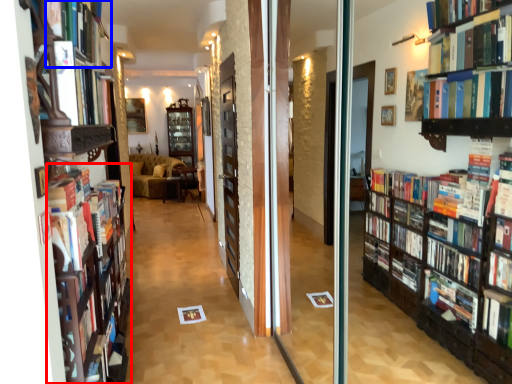
Question: Which of the following is the closest to the observer, bookshelf (highlighted by a red box) or book (highlighted by a blue box)?

Choices:
 (A) bookshelf
 (B) book

Answer: (B)